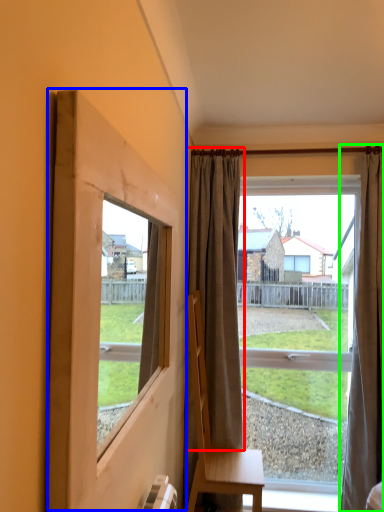
Question: Estimate the real-world distances between objects in this image. Which object is farther from curtain (highlighted by a red box), window frame (highlighted by a blue box) or curtain (highlighted by a green box)?

Choices:
 (A) window frame
 (B) curtain

Answer: (A)